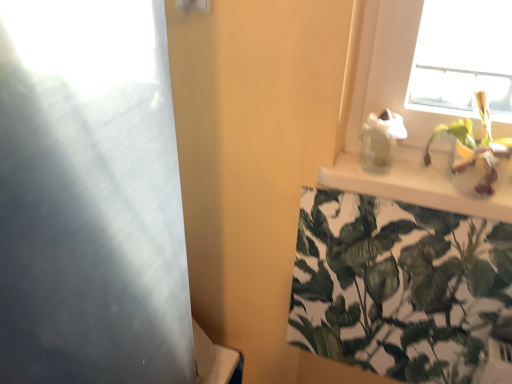
Question: Considering the relative sizes of transparent glass screen door at left and green leafy plant at upper right, arranged as the first houseplant when viewed from the top, in the image provided, is transparent glass screen door at left shorter than green leafy plant at upper right, arranged as the first houseplant when viewed from the top,?

Choices:
 (A) no
 (B) yes

Answer: (A)

Question: From the image's perspective, is transparent glass screen door at left below green leafy plant at upper right, which is counted as the 2th houseplant, starting from the bottom?

Choices:
 (A) no
 (B) yes

Answer: (B)

Question: Can you confirm if transparent glass screen door at left is bigger than green leafy plant at upper right, which is counted as the 2th houseplant, starting from the bottom?

Choices:
 (A) yes
 (B) no

Answer: (A)

Question: Does transparent glass screen door at left appear on the right side of green leafy plant at upper right, arranged as the first houseplant when viewed from the top?

Choices:
 (A) yes
 (B) no

Answer: (B)

Question: Is green leafy plant at upper right, which is counted as the 2th houseplant, starting from the bottom, a part of transparent glass screen door at left?

Choices:
 (A) no
 (B) yes

Answer: (A)

Question: Is transparent glass screen door at left far away from green leafy plant at upper right, arranged as the first houseplant when viewed from the top?

Choices:
 (A) no
 (B) yes

Answer: (A)

Question: From a real-world perspective, is green leafy plant at upper right, the 1th houseplant positioned from the bottom, beneath transparent glass screen door at left?

Choices:
 (A) no
 (B) yes

Answer: (B)

Question: Considering the relative sizes of green leafy plant at upper right, the 1th houseplant positioned from the bottom, and transparent glass screen door at left in the image provided, is green leafy plant at upper right, the 1th houseplant positioned from the bottom, taller than transparent glass screen door at left?

Choices:
 (A) yes
 (B) no

Answer: (B)

Question: Is green leafy plant at upper right, the 1th houseplant positioned from the bottom, looking in the opposite direction of transparent glass screen door at left?

Choices:
 (A) yes
 (B) no

Answer: (B)

Question: Does green leafy plant at upper right, the 1th houseplant positioned from the bottom, appear on the left side of transparent glass screen door at left?

Choices:
 (A) no
 (B) yes

Answer: (A)

Question: Considering the relative sizes of green leafy plant at upper right, the 1th houseplant positioned from the bottom, and transparent glass screen door at left in the image provided, is green leafy plant at upper right, the 1th houseplant positioned from the bottom, wider than transparent glass screen door at left?

Choices:
 (A) yes
 (B) no

Answer: (B)

Question: Considering the relative sizes of green leafy plant at upper right, the second houseplant when ordered from top to bottom, and transparent glass screen door at left in the image provided, is green leafy plant at upper right, the second houseplant when ordered from top to bottom, thinner than transparent glass screen door at left?

Choices:
 (A) yes
 (B) no

Answer: (A)

Question: Considering the relative sizes of white glossy shelf at upper right and green leafy plant at upper right, the second houseplant when ordered from top to bottom, in the image provided, is white glossy shelf at upper right smaller than green leafy plant at upper right, the second houseplant when ordered from top to bottom,?

Choices:
 (A) yes
 (B) no

Answer: (A)